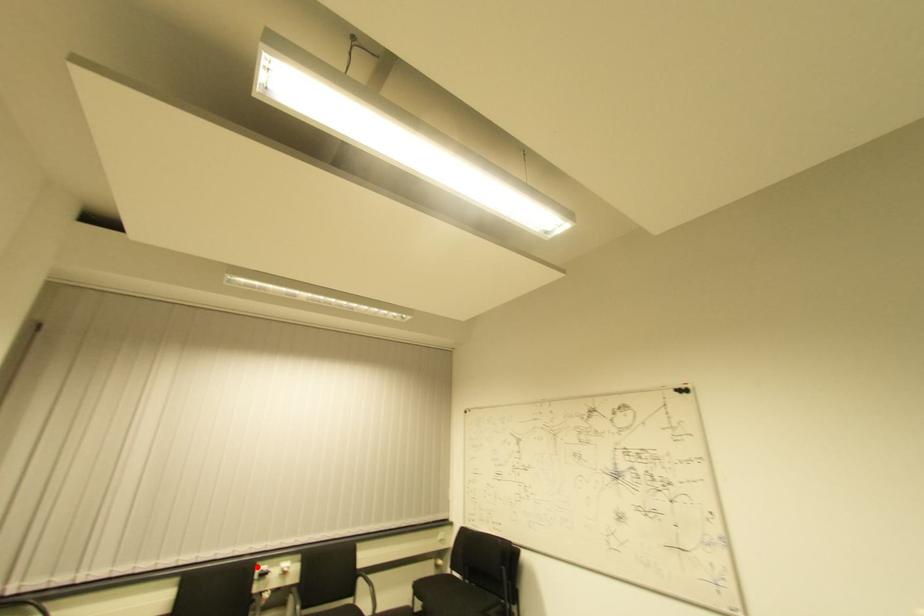
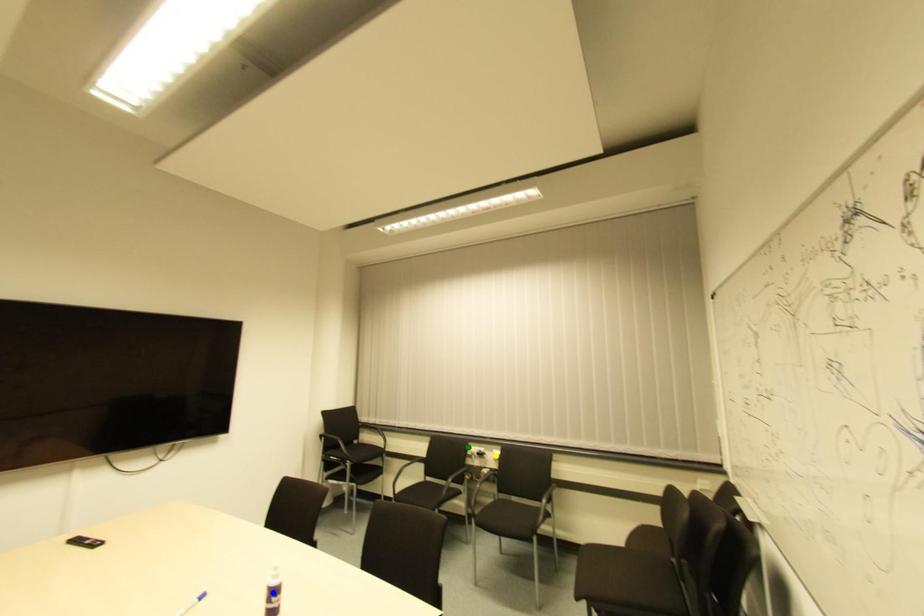
Question: I am providing you with two images of the same scene from different viewpoints. A red point is marked on the first image. You are given multiple points on the second image. Which spot in image 2 lines up with the point in image 1?

Choices:
 (A) blue point
 (B) yellow point
 (C) green point

Answer: (C)